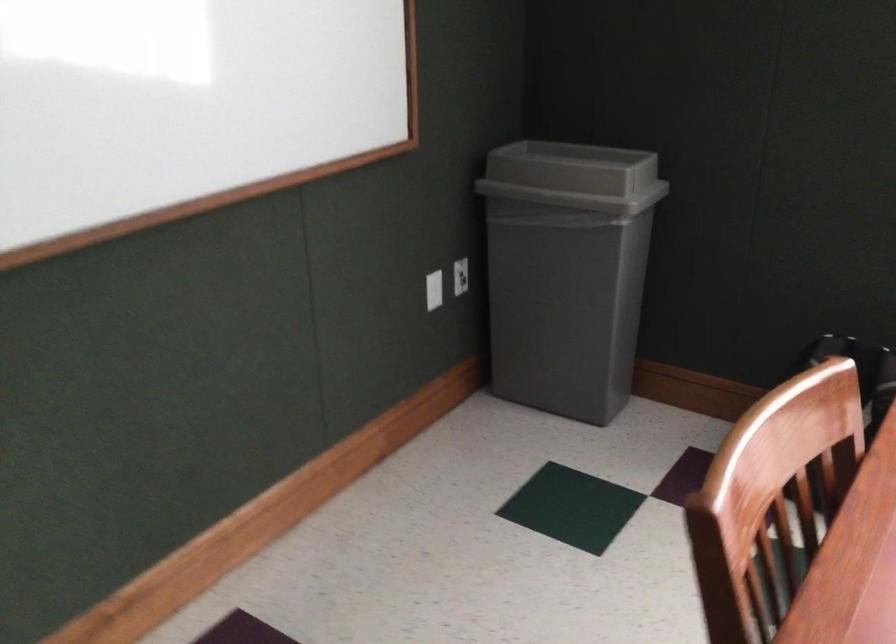
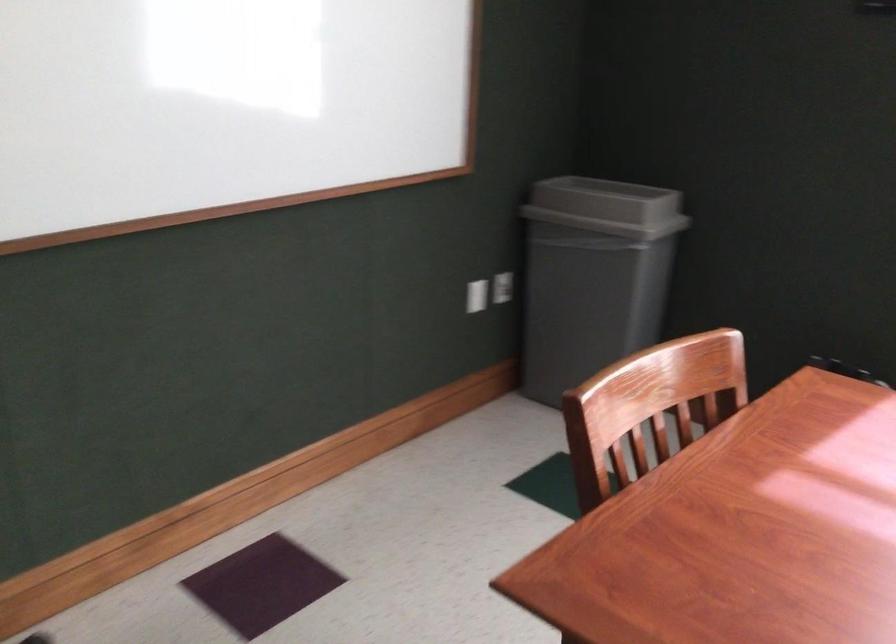
Find the pixel in the second image that matches point 581,180 in the first image.

(607, 207)